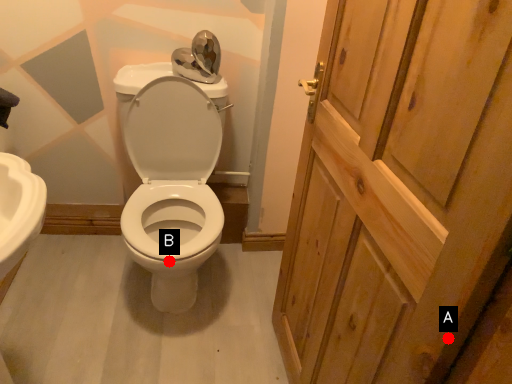
Question: Two points are circled on the image, labeled by A and B beside each circle. Among these points, which one is farthest from the camera?

Choices:
 (A) A is further
 (B) B is further

Answer: (B)